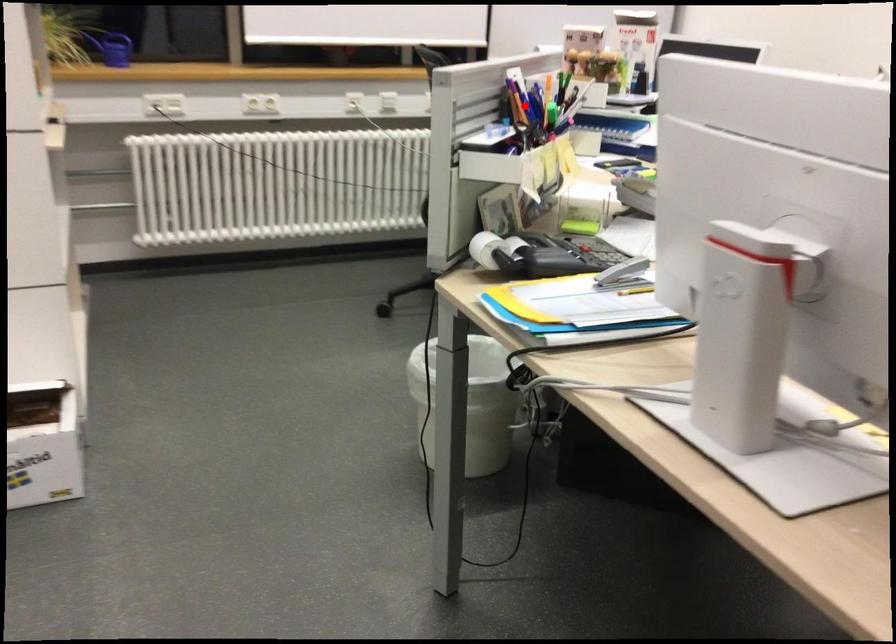
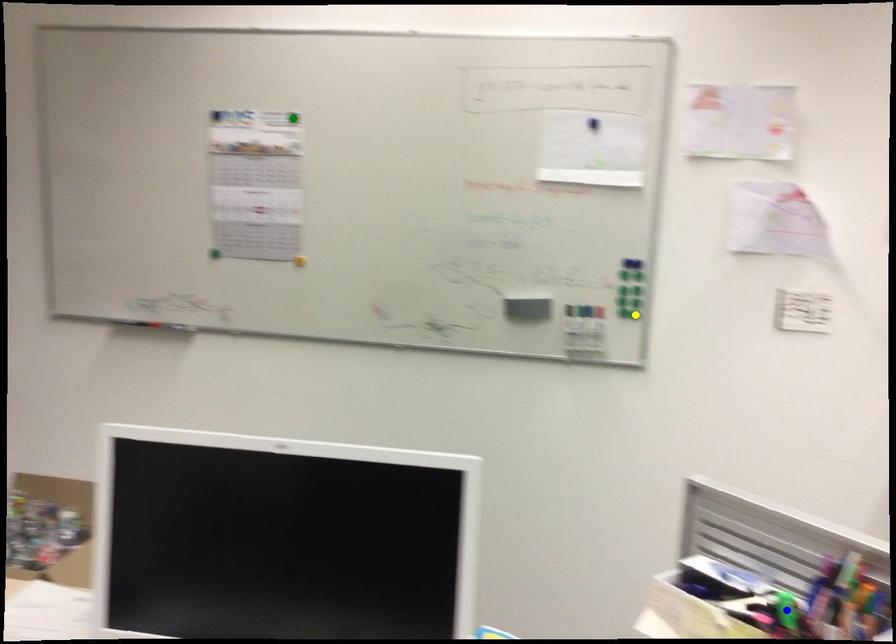
Question: I am providing you with two images of the same scene from different viewpoints. A red point is marked on the first image. You are given multiple points on the second image. Can you choose the point in image 2 that corresponds to the point in image 1?

Choices:
 (A) blue point
 (B) green point
 (C) yellow point

Answer: (A)